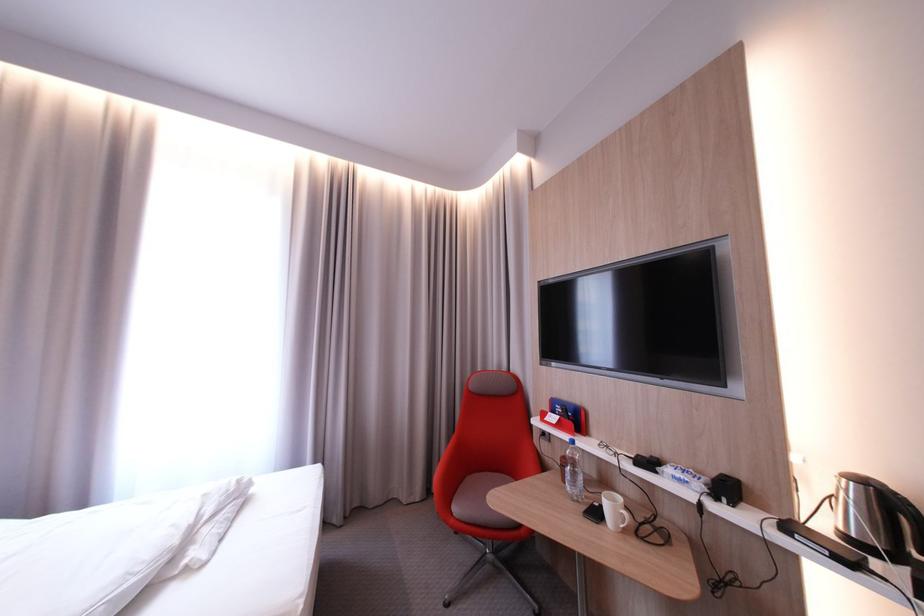
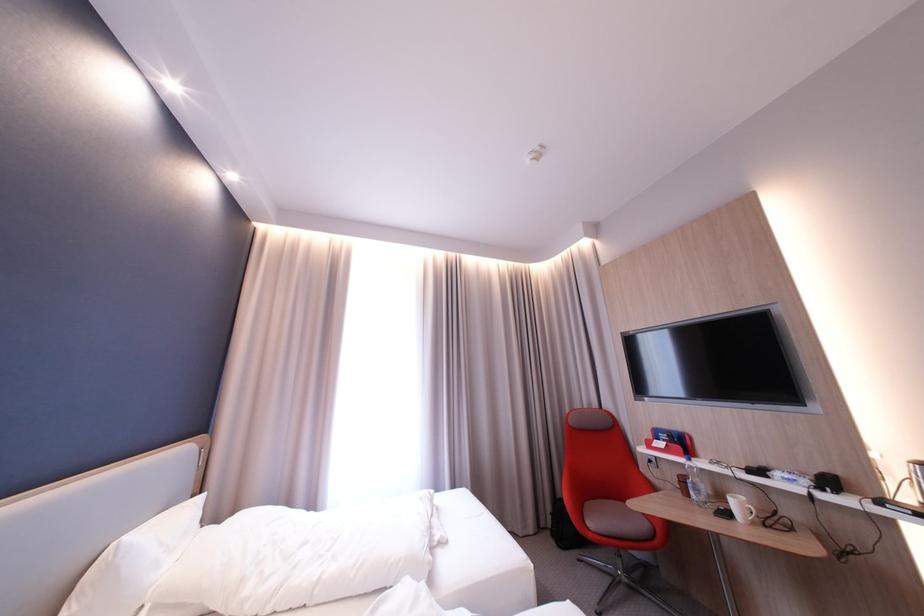
Question: I am providing you with two images of the same scene from different viewpoints. Which of the following objects are not visible in image2?

Choices:
 (A) red chair sitting surface
 (B) plastic water bottle
 (C) white mug
 (D) none of these

Answer: (D)